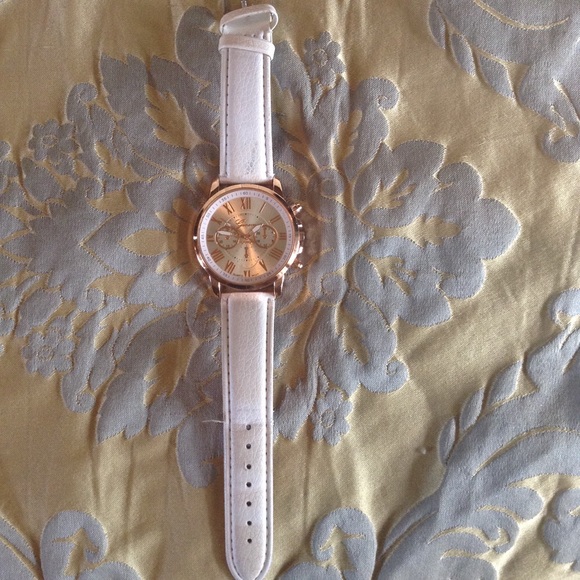
This screenshot has height=580, width=580. Find the location of `light grey blanket design`. light grey blanket design is located at coordinates (136, 276).